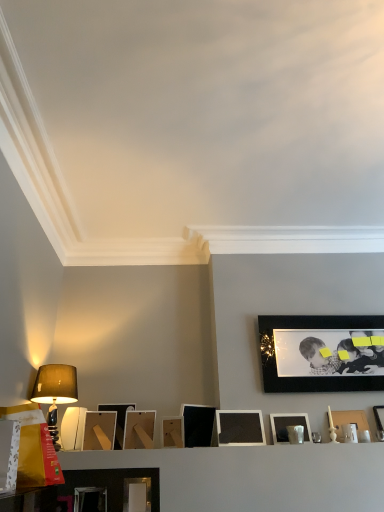
Question: Is point (165, 428) closer or farther from the camera than point (299, 353)?

Choices:
 (A) closer
 (B) farther

Answer: (A)

Question: Is matte wooden picture frame at center, arranged as the seventh picture frame when viewed from the right, bigger or smaller than black matte picture frame at upper right, the 11th picture frame in the left-to-right sequence?

Choices:
 (A) big
 (B) small

Answer: (B)

Question: Which object is the farthest from the matte black picture frame at right, the first picture frame from the right?

Choices:
 (A) matte black picture frame at center, which appears as the tenth picture frame when viewed from the left
 (B) white matte picture frame at center, the tenth picture frame in the right-to-left sequence
 (C) matte wooden picture frame at center, the 7th picture frame when ordered from left to right
 (D) matte wooden picture frame at center, which ranks as the fifth picture frame in left-to-right order
 (E) matte black picture frame at center, the 6th picture frame positioned from the right

Answer: (B)

Question: Which object is positioned closest to the matte black picture frame at center, which ranks as the fourth picture frame in right-to-left order?

Choices:
 (A) matte wooden picture frame at center, which ranks as the fifth picture frame in left-to-right order
 (B) matte white picture frame at right, placed as the 12th picture frame when sorted from left to right
 (C) matte brown lampshade at left
 (D) matte black picture frame at lower center, which is the twelfth picture frame in right-to-left order
 (E) white matte picture frame at center, the fourth picture frame positioned from the left

Answer: (B)